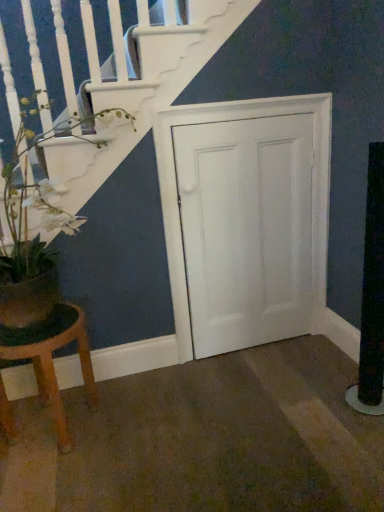
Find the location of `vacant space to the right of wooden stool at lower left`. vacant space to the right of wooden stool at lower left is located at coordinates (134, 419).